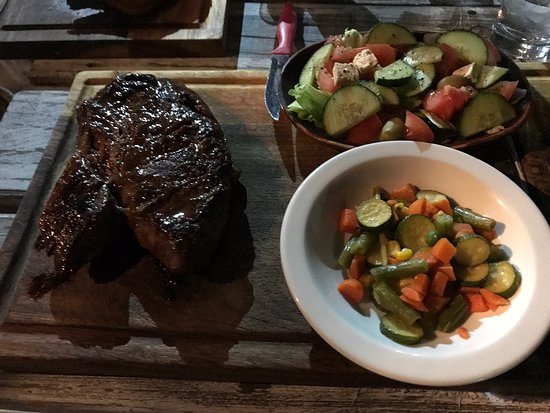
Where is `bowl`? bowl is located at coordinates (297, 270).